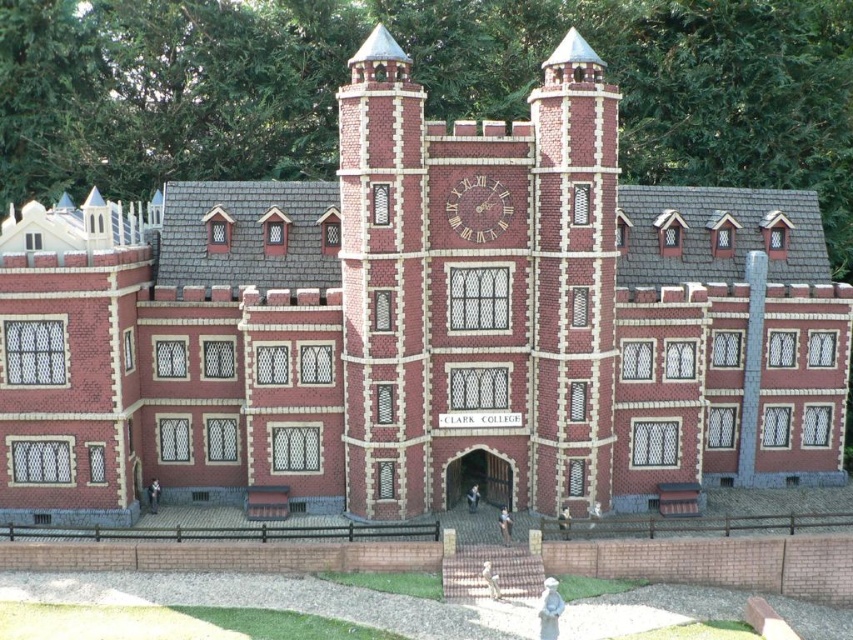
How far apart are matte brick statue at lower center and matte red brick statue at center?

They are 3.27 meters apart.

Describe the element at coordinates (490, 579) in the screenshot. I see `matte brick statue at lower center` at that location.

At what (x,y) coordinates should I click in order to perform the action: click on matte brick statue at lower center. Please return your answer as a coordinate pair (x, y). The image size is (853, 640). Looking at the image, I should click on (490, 579).

Is brick tower at center to the left of matte brick statue at lower center from the viewer's perspective?

Correct, you'll find brick tower at center to the left of matte brick statue at lower center.

Between brick tower at center and matte brick statue at lower center, which one has more height?

With more height is brick tower at center.

At what (x,y) coordinates should I click in order to perform the action: click on brick tower at center. Please return your answer as a coordinate pair (x, y). Looking at the image, I should click on 476,285.

In the scene shown: Which is more to the right, brick tower at center or matte red brick statue at center?

matte red brick statue at center is more to the right.

Who is more forward, (409, 147) or (509, 534)?

Positioned in front is point (409, 147).

Where is `brick tower at center`? Image resolution: width=853 pixels, height=640 pixels. brick tower at center is located at coordinates (476, 285).